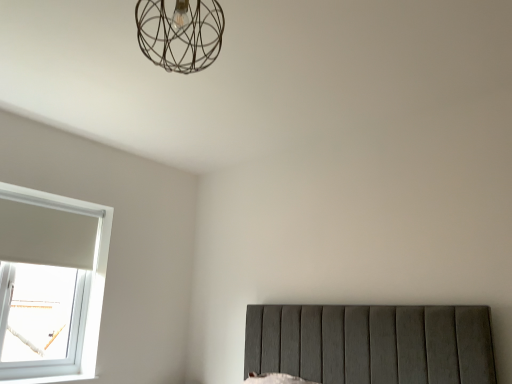
Question: From a real-world perspective, is metallic wire cage at upper center positioned above or below transparent glass window at lower left?

Choices:
 (A) above
 (B) below

Answer: (A)

Question: Does point (164, 16) appear closer or farther from the camera than point (50, 302)?

Choices:
 (A) closer
 (B) farther

Answer: (A)

Question: In the image, is metallic wire cage at upper center on the left side or the right side of transparent glass window at lower left?

Choices:
 (A) left
 (B) right

Answer: (B)

Question: Is transparent glass window at lower left bigger or smaller than metallic wire cage at upper center?

Choices:
 (A) small
 (B) big

Answer: (B)

Question: From a real-world perspective, is transparent glass window at lower left above or below metallic wire cage at upper center?

Choices:
 (A) above
 (B) below

Answer: (B)

Question: Is transparent glass window at lower left taller or shorter than metallic wire cage at upper center?

Choices:
 (A) short
 (B) tall

Answer: (B)

Question: Considering the relative positions of transparent glass window at lower left and metallic wire cage at upper center in the image provided, is transparent glass window at lower left to the left or to the right of metallic wire cage at upper center?

Choices:
 (A) right
 (B) left

Answer: (B)